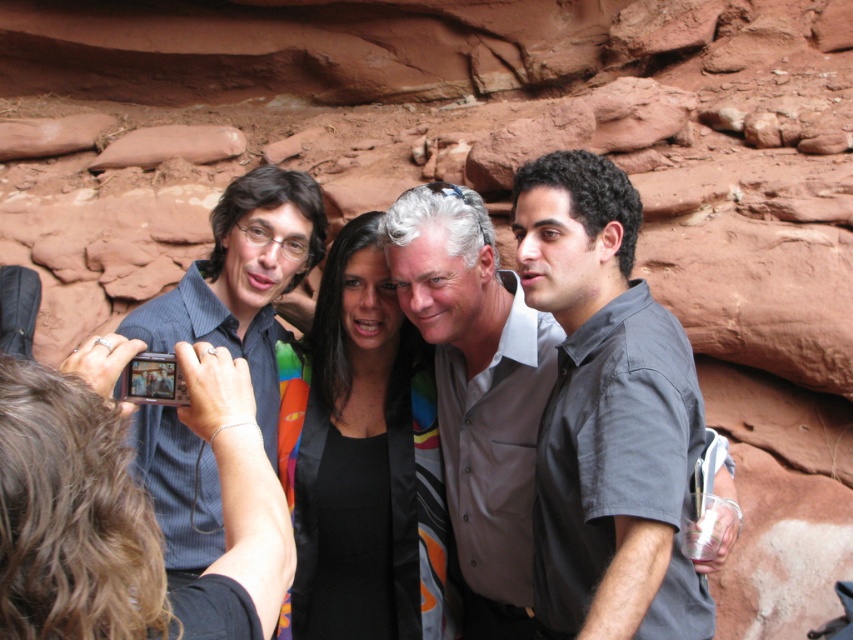
Is gray matte shirt at center to the left of blue striped shirt at left from the viewer's perspective?

In fact, gray matte shirt at center is to the right of blue striped shirt at left.

Describe the element at coordinates (477, 390) in the screenshot. This screenshot has width=853, height=640. I see `gray matte shirt at center` at that location.

You are a GUI agent. You are given a task and a screenshot of the screen. Output one action in this format:
    pyautogui.click(x=<x>, y=<y>)
    Task: Click on the gray matte shirt at center
    This screenshot has height=640, width=853.
    Given the screenshot: What is the action you would take?
    pyautogui.click(x=477, y=390)